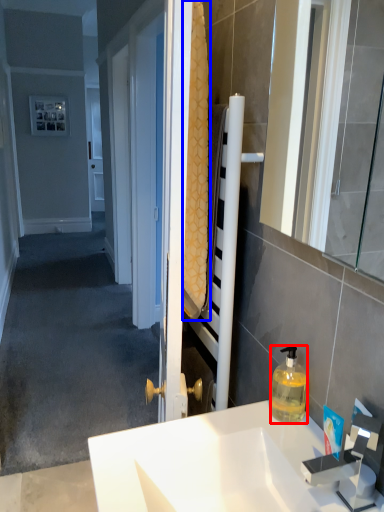
Question: Which point is further to the camera, bottle (highlighted by a red box) or bath towel (highlighted by a blue box)?

Choices:
 (A) bottle
 (B) bath towel

Answer: (A)